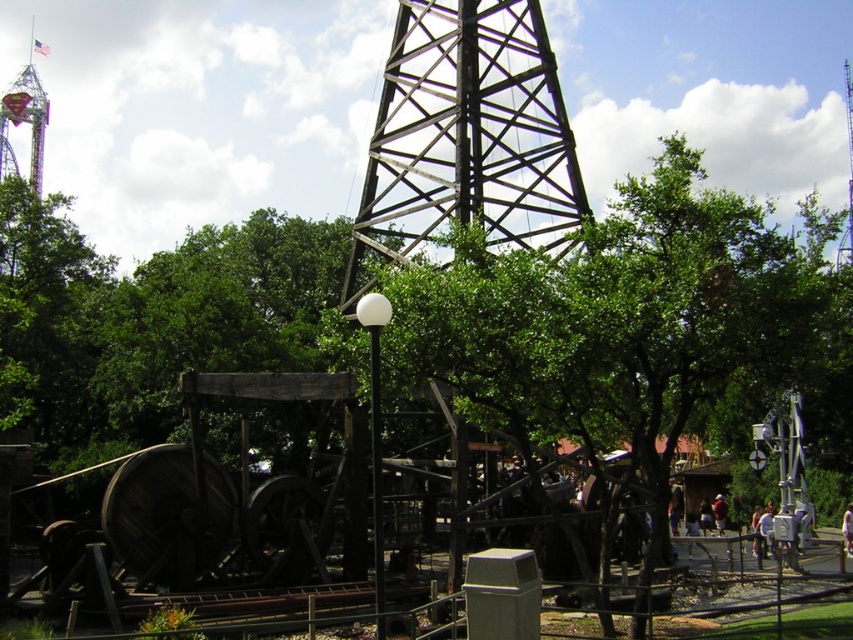
You are standing at the lamppost with a spherical white light fixture in the foreground of the theme park scene. You want to walk towards the base of the large oil derrick structure. Which of the two points, point (x=13, y=113) or point (x=374, y=540), should you pass through first?

You should pass through point (x=374, y=540) first because point (x=13, y=113) is behind it, meaning point (x=374, y=540) is closer to your starting position at the lamppost.